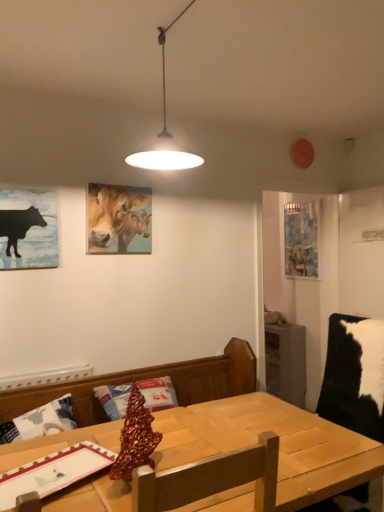
Question: Is blue fabric picture frame at right, placed as the third picture frame when sorted from left to right, bigger than black paper at left, which ranks as the third picture frame in right-to-left order?

Choices:
 (A) no
 (B) yes

Answer: (B)

Question: Does blue fabric picture frame at right, the 3th picture frame from the front, have a greater height compared to black paper at left, the first picture frame positioned from the left?

Choices:
 (A) no
 (B) yes

Answer: (B)

Question: From a real-world perspective, is blue fabric picture frame at right, the 3th picture frame from the front, physically above black paper at left, which ranks as the third picture frame in right-to-left order?

Choices:
 (A) no
 (B) yes

Answer: (A)

Question: Can you confirm if blue fabric picture frame at right, the 3th picture frame from the front, is thinner than black paper at left, the first picture frame positioned from the left?

Choices:
 (A) no
 (B) yes

Answer: (A)

Question: Considering the relative sizes of blue fabric picture frame at right, the 3th picture frame from the front, and black paper at left, the third picture frame positioned from the back, in the image provided, is blue fabric picture frame at right, the 3th picture frame from the front, wider than black paper at left, the third picture frame positioned from the back,?

Choices:
 (A) no
 (B) yes

Answer: (B)

Question: Is blue fabric picture frame at right, the 3th picture frame from the front, positioned behind black paper at left, which ranks as the third picture frame in right-to-left order?

Choices:
 (A) yes
 (B) no

Answer: (A)

Question: From a real-world perspective, is black paper at left, the third picture frame positioned from the back, beneath wooden table at center?

Choices:
 (A) yes
 (B) no

Answer: (B)

Question: Can you confirm if black paper at left, the first picture frame positioned from the left, is positioned to the right of wooden table at center?

Choices:
 (A) no
 (B) yes

Answer: (A)

Question: Considering the relative positions of black paper at left, the third picture frame positioned from the back, and wooden table at center in the image provided, is black paper at left, the third picture frame positioned from the back, to the left of wooden table at center from the viewer's perspective?

Choices:
 (A) yes
 (B) no

Answer: (A)

Question: Is black paper at left, the 1th picture frame positioned from the front, in contact with wooden table at center?

Choices:
 (A) no
 (B) yes

Answer: (A)

Question: Could you tell me if black paper at left, the first picture frame positioned from the left, is facing wooden table at center?

Choices:
 (A) no
 (B) yes

Answer: (A)

Question: Is black paper at left, the first picture frame positioned from the left, thinner than wooden table at center?

Choices:
 (A) no
 (B) yes

Answer: (B)

Question: Is wooden table at center to the right of black paper at left, the third picture frame positioned from the back, from the viewer's perspective?

Choices:
 (A) yes
 (B) no

Answer: (A)